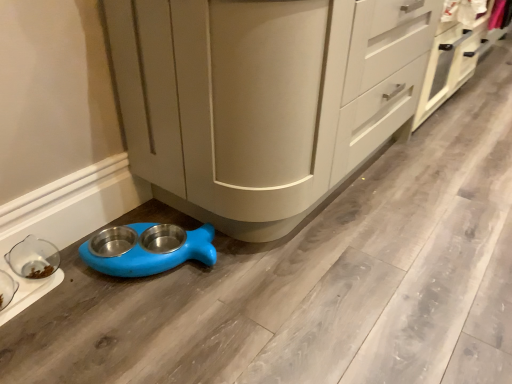
Find the location of a particular element. free space in front of white matte cabinet at center, which is counted as the second cabinetry, starting from the left is located at coordinates (461, 147).